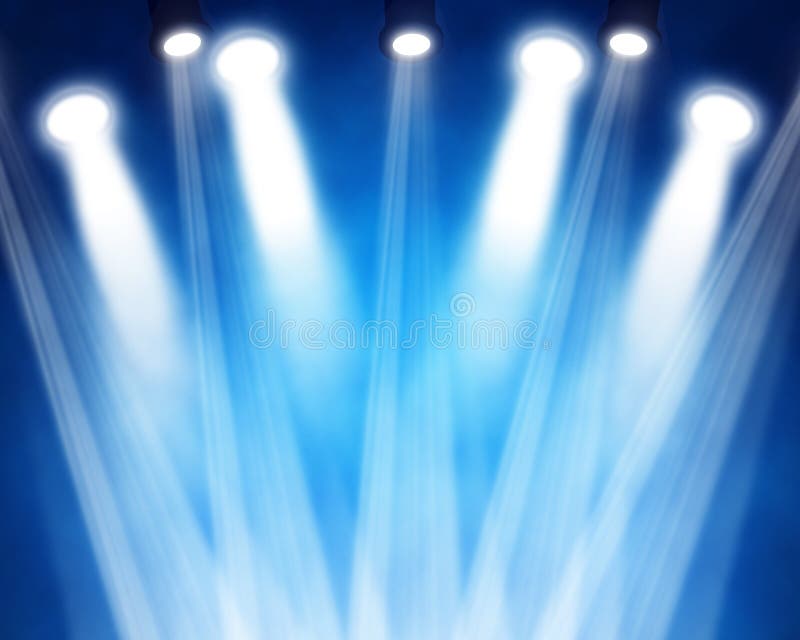
Identify the location of light. This screenshot has height=640, width=800. (92, 124), (192, 42), (244, 56), (420, 42), (548, 52), (636, 45), (724, 106).